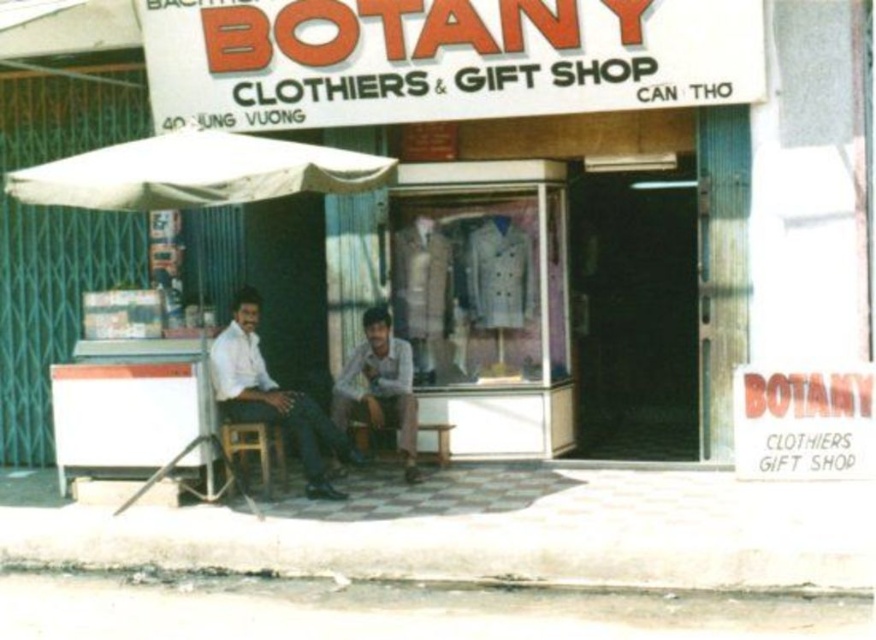
You are a delivery person with a cart that is 3 feet wide. You need to deliver a package to the store. There are two wooden stools in front of the store. Can you pass between the wooden stool at center and the wooden stool at lower center with your cart?

The wooden stool at center is 5.28 feet from the wooden stool at lower center. Since your cart is 3 feet wide, you can pass between them as the distance between the stools is wider than the cart.